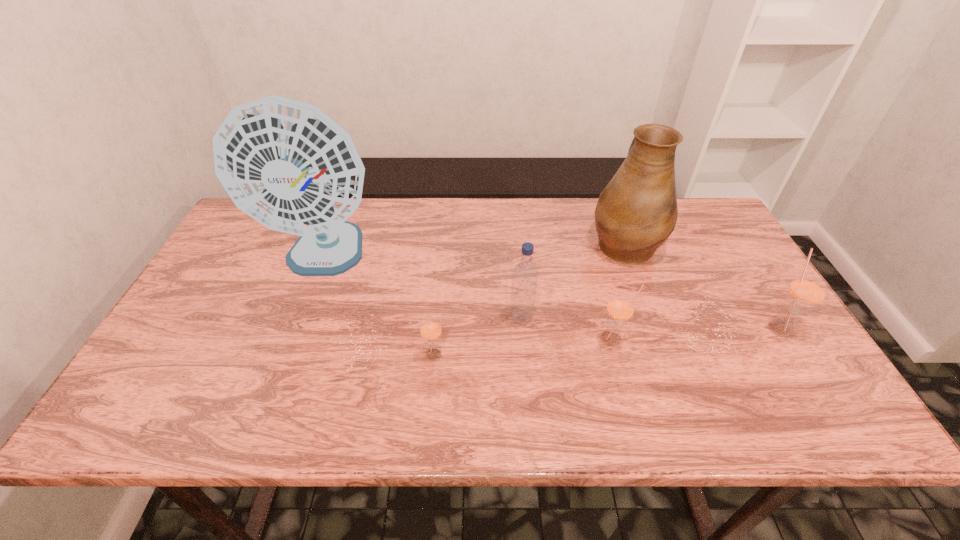
Where is `the shortest straw`? The image size is (960, 540). the shortest straw is located at coordinates (430, 328).

This screenshot has height=540, width=960. Find the location of `the fifth object from right to left`. the fifth object from right to left is located at coordinates (430, 328).

Identify the location of the fifth tallest object. (620, 308).

Find the location of a particular element. the second shortest straw is located at coordinates (620, 308).

What are the coordinates of `the tallest straw` in the screenshot? It's located at (806, 291).

Where is `the rightmost object`? The width and height of the screenshot is (960, 540). the rightmost object is located at coordinates (806, 291).

The width and height of the screenshot is (960, 540). What are the coordinates of `the fifth shortest object` in the screenshot? It's located at (636, 212).

This screenshot has width=960, height=540. Identify the location of fan. (287, 164).

What are the coordinates of `the tallest object` in the screenshot? It's located at (287, 164).

At what (x,y) coordinates should I click in order to perform the action: click on water bottle. Please return your answer as a coordinate pair (x, y). Looking at the image, I should click on (525, 274).